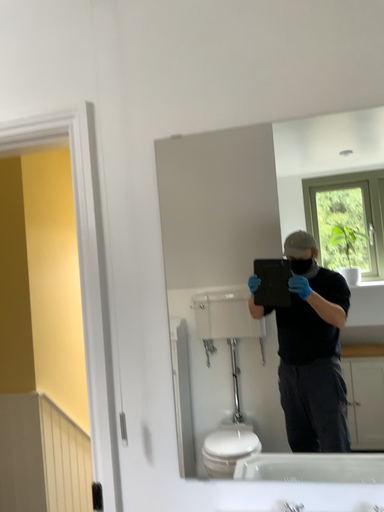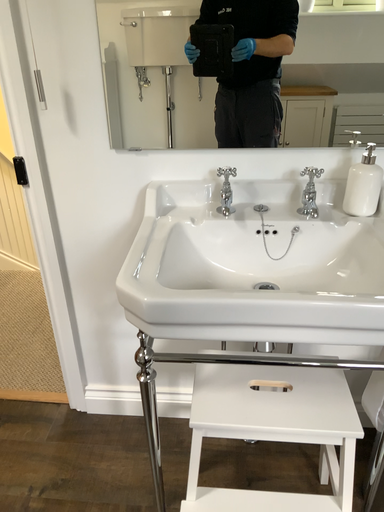
Question: Which way did the camera rotate in the video?

Choices:
 (A) rotated upward
 (B) rotated downward

Answer: (B)